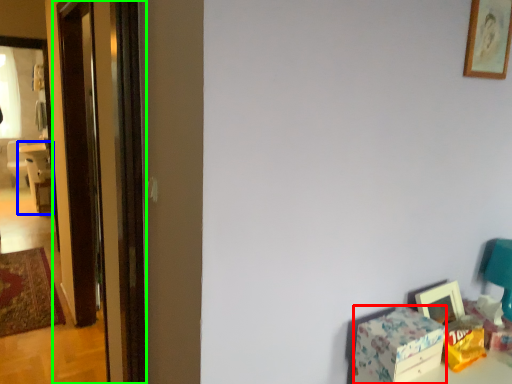
Question: Which object is positioned closest to box (highlighted by a red box)? Select from chair (highlighted by a blue box) and screen door (highlighted by a green box).

Choices:
 (A) chair
 (B) screen door

Answer: (B)